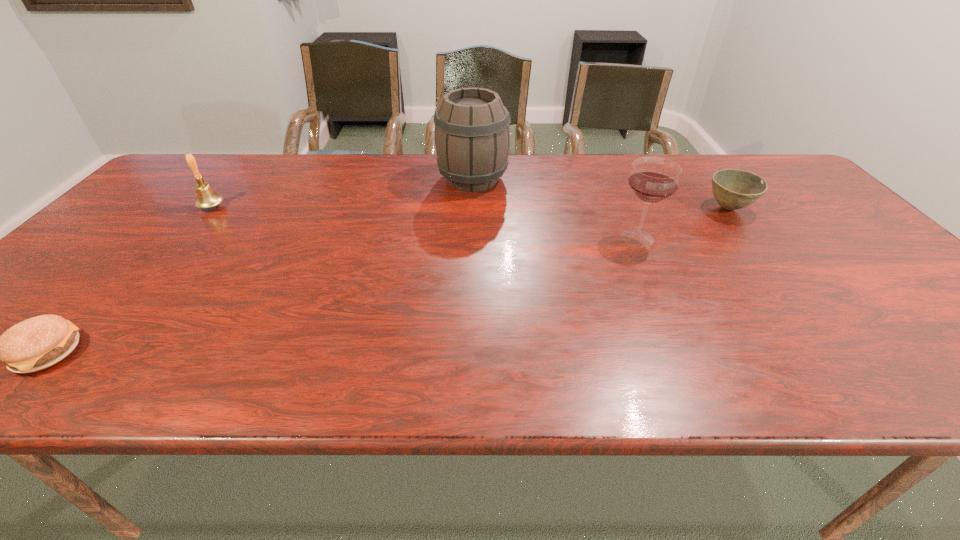
What are the coordinates of `blank region between the rightmost object and the fourth shortest object` in the screenshot? It's located at (683, 223).

Locate an element on the screen. This screenshot has width=960, height=540. empty space between the second nearest object and the second shortest object is located at coordinates (683, 223).

Find the location of a particular element. This screenshot has height=540, width=960. free spot between the rightmost object and the third tallest object is located at coordinates (470, 208).

I want to click on free space between the bowl and the bell, so click(470, 208).

What are the coordinates of `object that ranks as the third closest to the rightmost object` in the screenshot? It's located at (206, 197).

The height and width of the screenshot is (540, 960). I want to click on object that stands as the second closest to the wine bucket, so click(x=733, y=189).